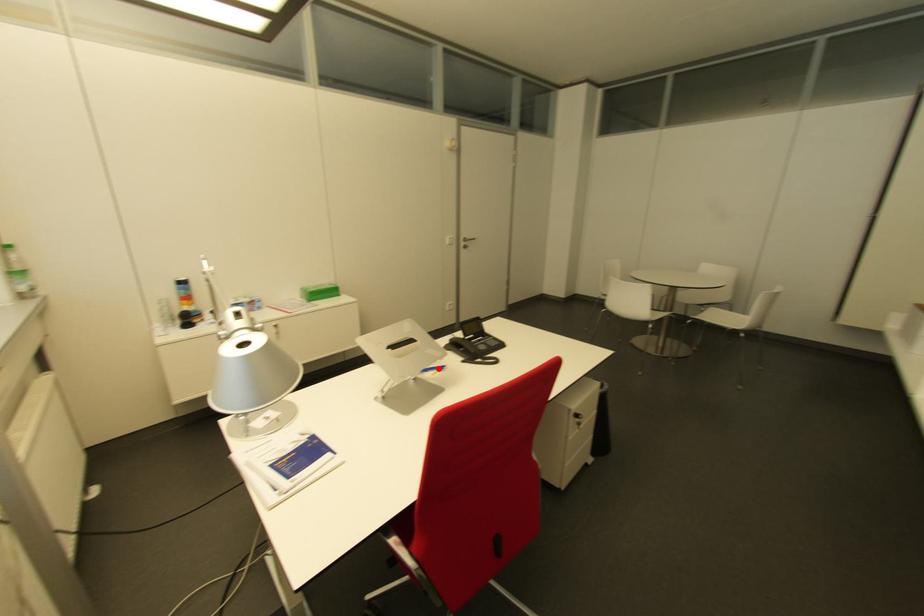
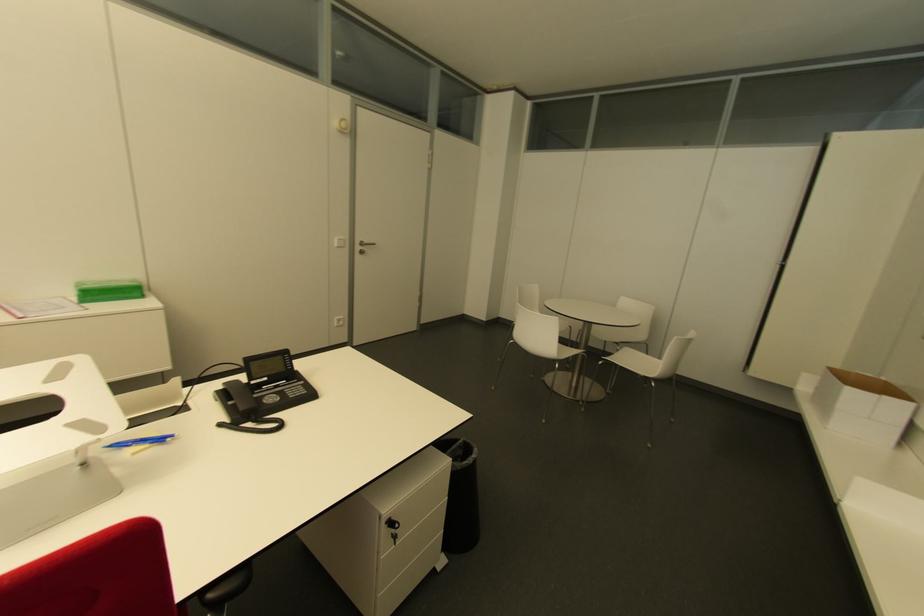
Where in the second image is the point corresponding to the highlighted location from the first image?

(159, 440)